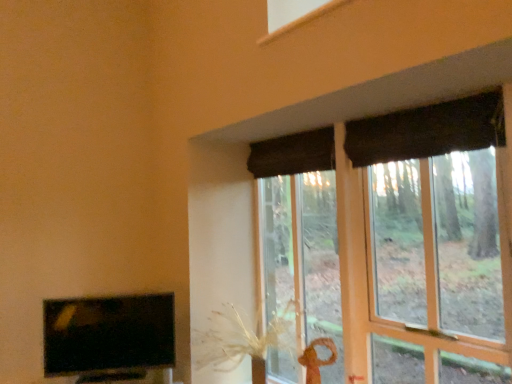
Question: Could you tell me if matte black tv at lower left is turned towards dark fabric curtain at upper center, the first curtain in the left-to-right sequence?

Choices:
 (A) yes
 (B) no

Answer: (B)

Question: Is matte black tv at lower left next to dark fabric curtain at upper center, the first curtain in the left-to-right sequence, and touching it?

Choices:
 (A) no
 (B) yes

Answer: (A)

Question: Is matte black tv at lower left further to the viewer compared to dark fabric curtain at upper center, the first curtain in the left-to-right sequence?

Choices:
 (A) no
 (B) yes

Answer: (A)

Question: Considering the relative positions of matte black tv at lower left and dark fabric curtain at upper center, the first curtain in the left-to-right sequence, in the image provided, is matte black tv at lower left to the left of dark fabric curtain at upper center, the first curtain in the left-to-right sequence, from the viewer's perspective?

Choices:
 (A) yes
 (B) no

Answer: (A)

Question: Considering the relative sizes of matte black tv at lower left and dark fabric curtain at upper center, the first curtain in the left-to-right sequence, in the image provided, is matte black tv at lower left thinner than dark fabric curtain at upper center, the first curtain in the left-to-right sequence,?

Choices:
 (A) no
 (B) yes

Answer: (B)

Question: Do you think dark fabric curtain at upper center, the first curtain in the left-to-right sequence, is within dark fabric curtain at upper right, acting as the 1th curtain starting from the right, or outside of it?

Choices:
 (A) inside
 (B) outside

Answer: (B)

Question: Based on their positions, is dark fabric curtain at upper center, which is counted as the 1th curtain, starting from the back, located to the left or right of dark fabric curtain at upper right, acting as the 1th curtain starting from the right?

Choices:
 (A) left
 (B) right

Answer: (A)

Question: In terms of width, does dark fabric curtain at upper center, the 2th curtain when ordered from front to back, look wider or thinner when compared to dark fabric curtain at upper right, placed as the 2th curtain when sorted from back to front?

Choices:
 (A) wide
 (B) thin

Answer: (B)

Question: From a real-world perspective, relative to dark fabric curtain at upper right, acting as the 1th curtain starting from the right, is dark fabric curtain at upper center, the 2th curtain when ordered from front to back, vertically above or below?

Choices:
 (A) above
 (B) below

Answer: (A)

Question: In terms of size, does matte brown curtain at upper right appear bigger or smaller than dark fabric curtain at upper right, marked as the second curtain in a left-to-right arrangement?

Choices:
 (A) big
 (B) small

Answer: (A)

Question: Is matte brown curtain at upper right spatially inside dark fabric curtain at upper right, placed as the 2th curtain when sorted from back to front, or outside of it?

Choices:
 (A) inside
 (B) outside

Answer: (B)

Question: Does point (415, 109) appear closer or farther from the camera than point (287, 147)?

Choices:
 (A) farther
 (B) closer

Answer: (B)

Question: In the image, is matte brown curtain at upper right on the left side or the right side of dark fabric curtain at upper right, placed as the 2th curtain when sorted from back to front?

Choices:
 (A) left
 (B) right

Answer: (A)

Question: Does point (324, 148) appear closer or farther from the camera than point (173, 349)?

Choices:
 (A) farther
 (B) closer

Answer: (A)

Question: Looking at the image, does dark fabric curtain at upper center, the first curtain in the left-to-right sequence, seem bigger or smaller compared to matte black tv at lower left?

Choices:
 (A) big
 (B) small

Answer: (B)